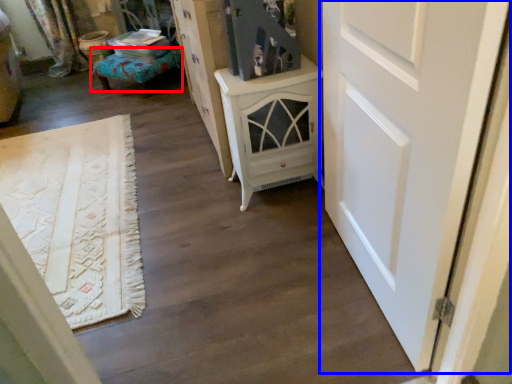
Question: Which point is further to the camera, furniture (highlighted by a red box) or door (highlighted by a blue box)?

Choices:
 (A) furniture
 (B) door

Answer: (A)